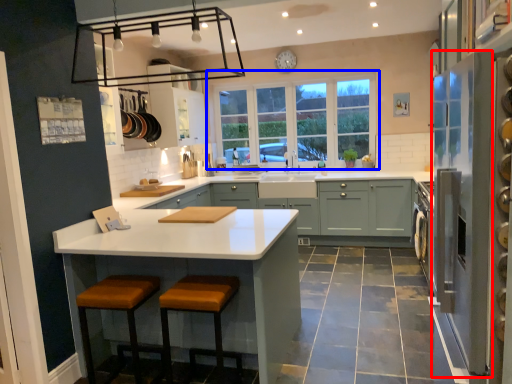
Question: Which object appears closest to the camera in this image, glass door (highlighted by a red box) or window (highlighted by a blue box)?

Choices:
 (A) glass door
 (B) window

Answer: (A)